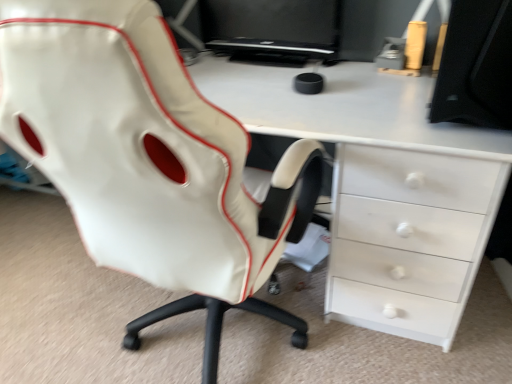
Question: Do you think black glossy monitor at upper center is within black matte monitor at upper right, or outside of it?

Choices:
 (A) inside
 (B) outside

Answer: (B)

Question: Considering the positions of point pyautogui.click(x=309, y=11) and point pyautogui.click(x=480, y=51), is point pyautogui.click(x=309, y=11) closer or farther from the camera than point pyautogui.click(x=480, y=51)?

Choices:
 (A) closer
 (B) farther

Answer: (B)

Question: Considering the real-world distances, which object is closest to the black matte monitor at upper right?

Choices:
 (A) white glossy desk at center
 (B) black glossy monitor at upper center
 (C) white leather chair at center

Answer: (A)

Question: Estimate the real-world distances between objects in this image. Which object is closer to the black matte monitor at upper right?

Choices:
 (A) white leather chair at center
 (B) white glossy desk at center
 (C) black glossy monitor at upper center

Answer: (B)